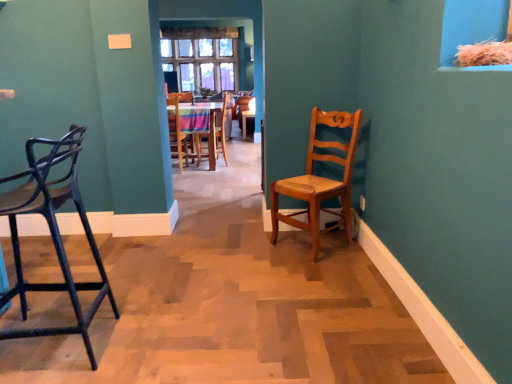
Locate an element on the screen. The image size is (512, 384). free space between light brown wooden chair at center, which is counted as the 2th chair, starting from the front, and matte black stool at left, the 5th chair viewed from the back is located at coordinates (210, 282).